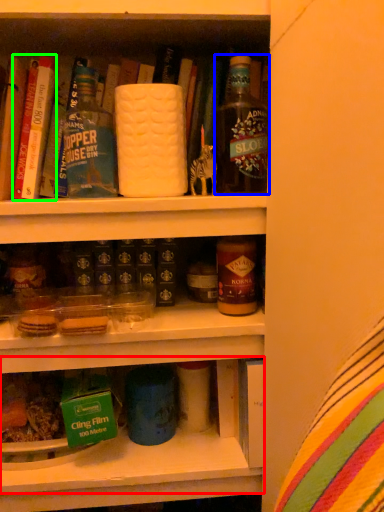
Question: Considering the real-world distances, which object is farthest from shelf (highlighted by a red box)? bottle (highlighted by a blue box) or book (highlighted by a green box)?

Choices:
 (A) bottle
 (B) book

Answer: (B)